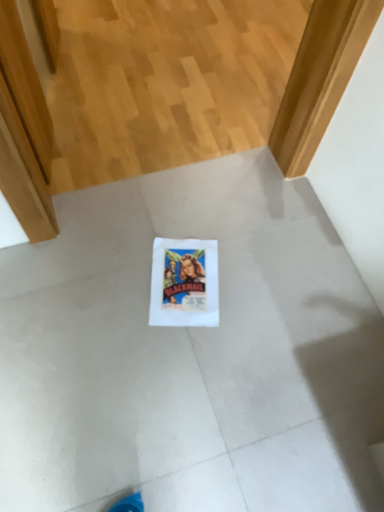
Where is `vacant space in front of white paper flyer at center`? The width and height of the screenshot is (384, 512). vacant space in front of white paper flyer at center is located at coordinates (176, 355).